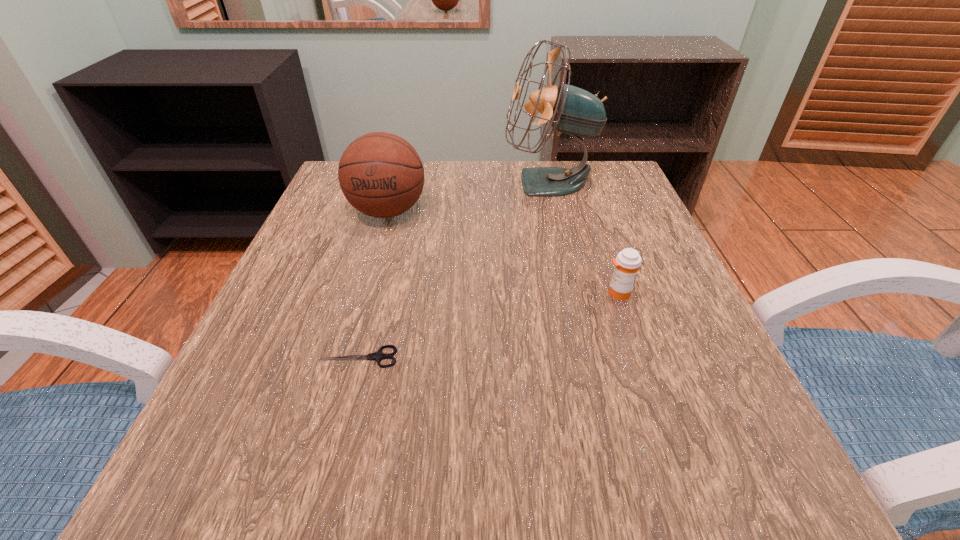
Locate an element on the screen. Image resolution: width=960 pixels, height=540 pixels. free space located on the front of the third tallest object is located at coordinates (630, 326).

Identify the location of vacant space located 0.400m on the back of the nearest object. This screenshot has height=540, width=960. (396, 210).

Where is `fan situated at the far edge`? The height and width of the screenshot is (540, 960). fan situated at the far edge is located at coordinates (571, 110).

What are the coordinates of `basketball located in the far edge section of the desktop` in the screenshot? It's located at (381, 175).

Where is `basketball that is at the left edge`? The image size is (960, 540). basketball that is at the left edge is located at coordinates (381, 175).

This screenshot has height=540, width=960. Identify the location of shears present at the left edge. (378, 355).

Where is `fan that is at the right edge`? The height and width of the screenshot is (540, 960). fan that is at the right edge is located at coordinates (571, 110).

The width and height of the screenshot is (960, 540). Find the location of `medicine located in the right edge section of the desktop`. medicine located in the right edge section of the desktop is located at coordinates (627, 263).

Identify the location of object located in the far left corner section of the desktop. (381, 175).

I want to click on object that is at the far right corner, so click(x=571, y=110).